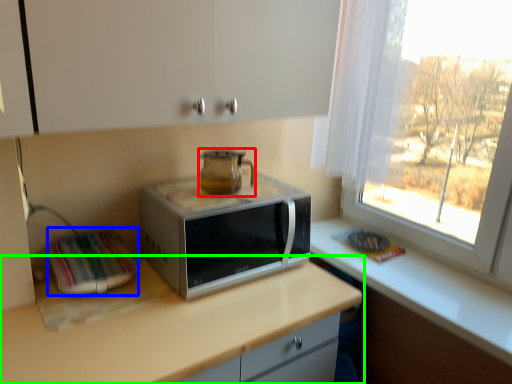
Question: Estimate the real-world distances between objects in this image. Which object is closer to home appliance (highlighted by a red box), appliance (highlighted by a blue box) or countertop (highlighted by a green box)?

Choices:
 (A) appliance
 (B) countertop

Answer: (A)